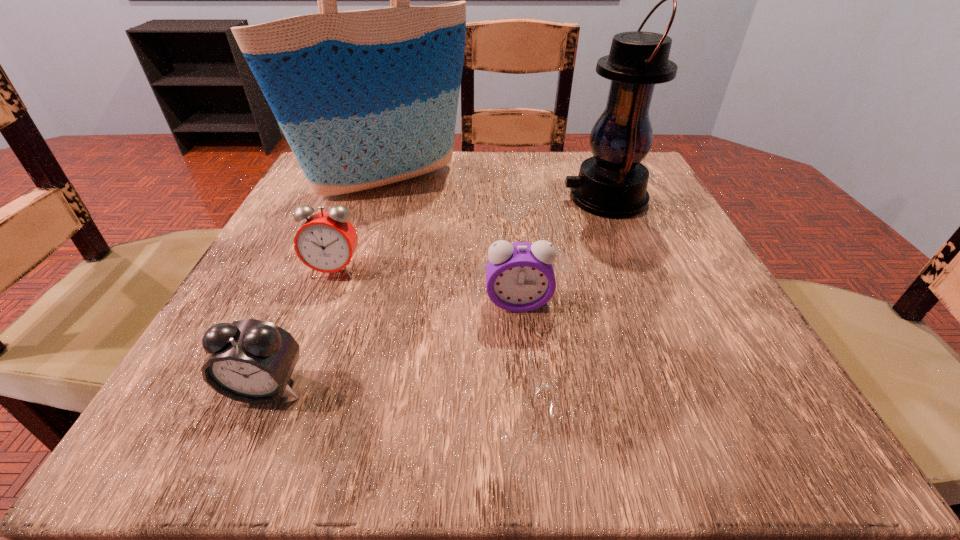
Locate several points within the vacant space positioned 0.370m above the rightmost object, indicating its light source. Please provide its 2D coordinates. Your answer should be formatted as a tuple, i.e. [(x, y)], where the tuple contains the x and y coordinates of a point satisfying the conditions above.

[(374, 199)]

At what (x,y) coordinates should I click in order to perform the action: click on vacant space situated on the front-facing side of the third nearest object. Please return your answer as a coordinate pair (x, y). This screenshot has height=540, width=960. Looking at the image, I should click on (274, 430).

Find the location of a particular element. The width and height of the screenshot is (960, 540). free space located on the face of the fourth farthest object is located at coordinates (529, 420).

Where is `tote bag present at the far edge`? tote bag present at the far edge is located at coordinates (365, 98).

Find the location of a particular element. The width and height of the screenshot is (960, 540). lantern located in the far edge section of the desktop is located at coordinates (613, 183).

Where is `object at the near edge`? Image resolution: width=960 pixels, height=540 pixels. object at the near edge is located at coordinates (251, 361).

Identify the location of tote bag located at the left edge. The image size is (960, 540). (365, 98).

Where is `object that is positioned at the right edge`? This screenshot has height=540, width=960. object that is positioned at the right edge is located at coordinates (613, 183).

Identify the location of object that is positioned at the far left corner. (365, 98).

Locate an element on the screen. The image size is (960, 540). object that is positioned at the near left corner is located at coordinates (251, 361).